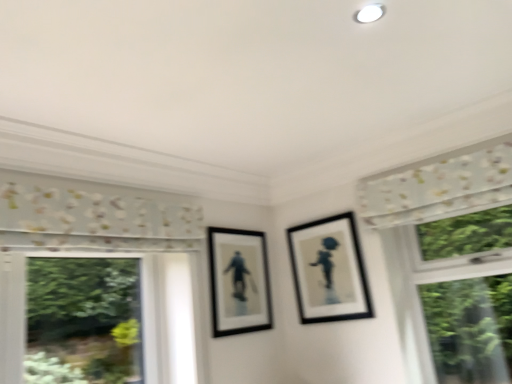
Question: From a real-world perspective, does matte black picture frame at center, which ranks as the 1th picture frame in left-to-right order, stand above white floral fabric at upper right?

Choices:
 (A) yes
 (B) no

Answer: (B)

Question: Is white floral fabric at upper right located within matte black picture frame at center, which is counted as the second picture frame, starting from the right?

Choices:
 (A) no
 (B) yes

Answer: (A)

Question: Is matte black picture frame at center, which is counted as the second picture frame, starting from the right, positioned far away from white floral fabric at upper right?

Choices:
 (A) no
 (B) yes

Answer: (A)

Question: Can you confirm if matte black picture frame at center, which is counted as the second picture frame, starting from the right, is bigger than white floral fabric at upper right?

Choices:
 (A) no
 (B) yes

Answer: (A)

Question: Considering the relative sizes of matte black picture frame at center, which is counted as the second picture frame, starting from the right, and white floral fabric at upper right in the image provided, is matte black picture frame at center, which is counted as the second picture frame, starting from the right, wider than white floral fabric at upper right?

Choices:
 (A) no
 (B) yes

Answer: (A)

Question: Is matte black picture frame at center, which ranks as the 1th picture frame in left-to-right order, wider or thinner than black matte picture frame at upper right, which ranks as the second picture frame in left-to-right order?

Choices:
 (A) wide
 (B) thin

Answer: (B)

Question: From a real-world perspective, is matte black picture frame at center, which ranks as the 1th picture frame in left-to-right order, physically located above or below black matte picture frame at upper right, which ranks as the second picture frame in left-to-right order?

Choices:
 (A) below
 (B) above

Answer: (A)

Question: Does point (225, 238) appear closer or farther from the camera than point (307, 292)?

Choices:
 (A) closer
 (B) farther

Answer: (A)

Question: Visually, is matte black picture frame at center, which is counted as the second picture frame, starting from the right, positioned to the left or to the right of black matte picture frame at upper right, which is counted as the first picture frame, starting from the right?

Choices:
 (A) right
 (B) left

Answer: (B)

Question: From the image's perspective, is white floral fabric at upper right above or below black matte picture frame at upper right, which ranks as the second picture frame in left-to-right order?

Choices:
 (A) above
 (B) below

Answer: (A)

Question: Considering their positions, is white floral fabric at upper right located in front of or behind black matte picture frame at upper right, which ranks as the second picture frame in left-to-right order?

Choices:
 (A) front
 (B) behind

Answer: (A)

Question: Looking at their shapes, would you say white floral fabric at upper right is wider or thinner than black matte picture frame at upper right, which ranks as the second picture frame in left-to-right order?

Choices:
 (A) wide
 (B) thin

Answer: (A)

Question: In the image, is white floral fabric at upper right on the left side or the right side of black matte picture frame at upper right, which is counted as the first picture frame, starting from the right?

Choices:
 (A) left
 (B) right

Answer: (B)

Question: In the image, is white floral fabric at upper right on the left side or the right side of matte black picture frame at center, which ranks as the 1th picture frame in left-to-right order?

Choices:
 (A) right
 (B) left

Answer: (A)

Question: From the image's perspective, is white floral fabric at upper right positioned above or below matte black picture frame at center, which is counted as the second picture frame, starting from the right?

Choices:
 (A) above
 (B) below

Answer: (A)